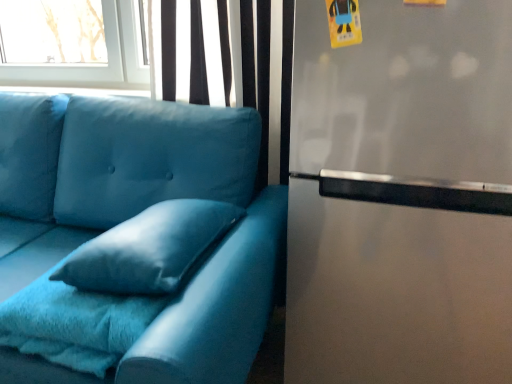
Question: Considering the relative positions of stainless steel fridge at right and fuzzy blue blanket at lower left in the image provided, is stainless steel fridge at right behind fuzzy blue blanket at lower left?

Choices:
 (A) yes
 (B) no

Answer: (B)

Question: Could you tell me if stainless steel fridge at right is facing fuzzy blue blanket at lower left?

Choices:
 (A) yes
 (B) no

Answer: (B)

Question: Can you confirm if stainless steel fridge at right is positioned to the left of fuzzy blue blanket at lower left?

Choices:
 (A) yes
 (B) no

Answer: (B)

Question: Does stainless steel fridge at right have a greater height compared to fuzzy blue blanket at lower left?

Choices:
 (A) no
 (B) yes

Answer: (B)

Question: Would you say fuzzy blue blanket at lower left is part of stainless steel fridge at right's contents?

Choices:
 (A) no
 (B) yes

Answer: (A)

Question: Does stainless steel fridge at right come in front of fuzzy blue blanket at lower left?

Choices:
 (A) no
 (B) yes

Answer: (B)

Question: Can you confirm if stainless steel fridge at right is positioned to the left of matte blue fabric couch at left?

Choices:
 (A) yes
 (B) no

Answer: (B)

Question: Does stainless steel fridge at right have a greater height compared to matte blue fabric couch at left?

Choices:
 (A) yes
 (B) no

Answer: (A)

Question: Is stainless steel fridge at right positioned with its back to matte blue fabric couch at left?

Choices:
 (A) no
 (B) yes

Answer: (A)

Question: Is stainless steel fridge at right bigger than matte blue fabric couch at left?

Choices:
 (A) yes
 (B) no

Answer: (B)

Question: Is matte blue fabric couch at left inside stainless steel fridge at right?

Choices:
 (A) yes
 (B) no

Answer: (B)

Question: From a real-world perspective, does stainless steel fridge at right stand above matte blue fabric couch at left?

Choices:
 (A) no
 (B) yes

Answer: (B)

Question: Would you consider velvet blue pillow at center to be distant from stainless steel fridge at right?

Choices:
 (A) no
 (B) yes

Answer: (A)